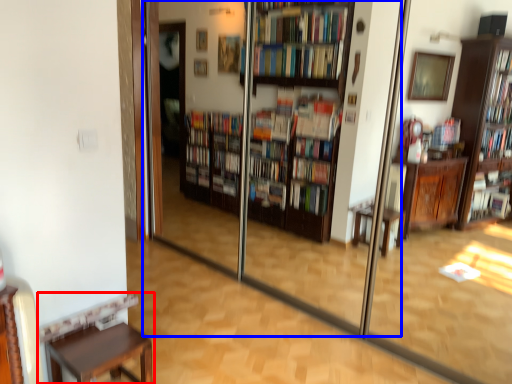
Question: Among these objects, which one is farthest to the camera, furniture (highlighted by a red box) or screen door (highlighted by a blue box)?

Choices:
 (A) furniture
 (B) screen door

Answer: (A)